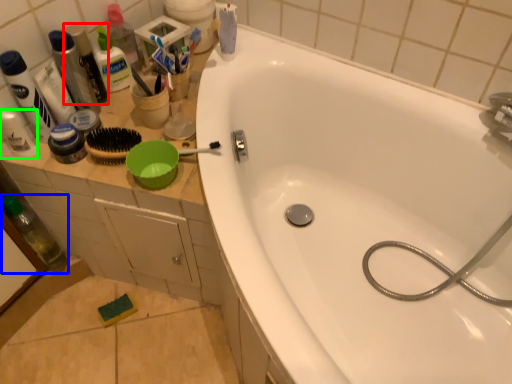
Question: Which object is the closest to the toiletry (highlighted by a red box)? Choose among these: bottle (highlighted by a blue box) or toiletry (highlighted by a green box).

Choices:
 (A) bottle
 (B) toiletry

Answer: (B)